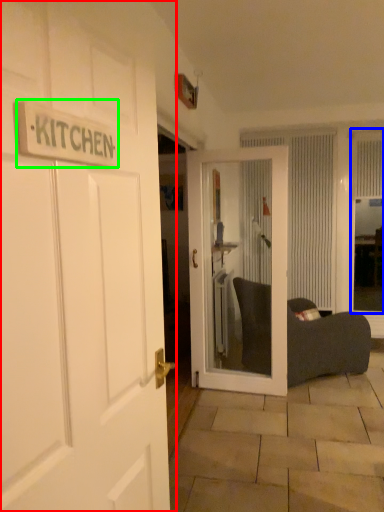
Question: Which is nearer to the door (highlighted by a red box)? window screen (highlighted by a blue box) or sign (highlighted by a green box).

Choices:
 (A) window screen
 (B) sign

Answer: (B)